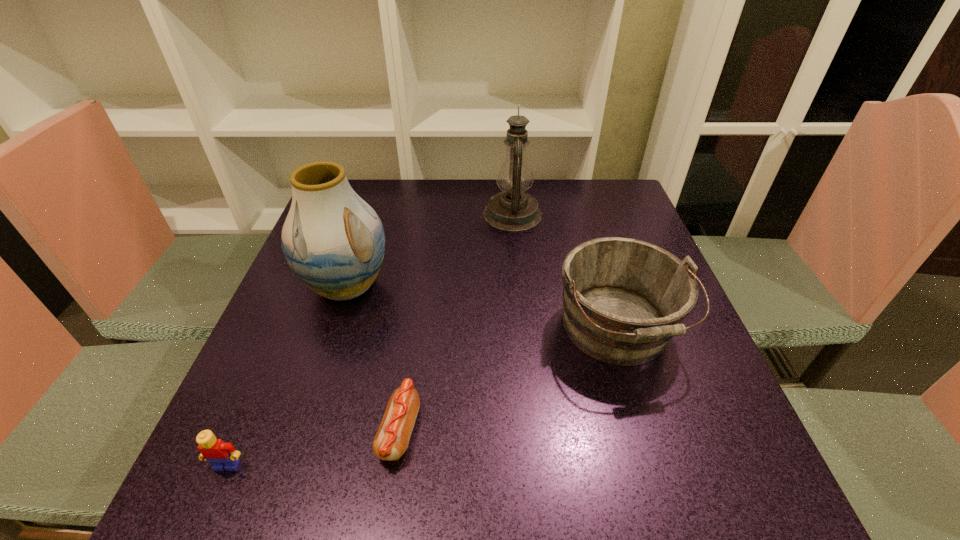
This screenshot has height=540, width=960. In order to click on oil lamp in this screenshot , I will do `click(513, 210)`.

Where is `vase`? This screenshot has width=960, height=540. vase is located at coordinates (334, 242).

Image resolution: width=960 pixels, height=540 pixels. I want to click on the third tallest object, so click(624, 299).

Identify the location of Lego. The image size is (960, 540). (221, 455).

Image resolution: width=960 pixels, height=540 pixels. Identify the location of the shortest object. (391, 441).

In order to click on sausage in this screenshot , I will do `click(391, 441)`.

Where is `vacant area situated 0.320m on the left of the oil lamp`? vacant area situated 0.320m on the left of the oil lamp is located at coordinates (366, 214).

Locate an element on the screen. The height and width of the screenshot is (540, 960). vacant area located on the front of the vase is located at coordinates (315, 384).

Where is `blank space located on the front of the wine bucket`? blank space located on the front of the wine bucket is located at coordinates (655, 455).

Locate an element on the screen. This screenshot has height=540, width=960. free location located on the face of the second shortest object is located at coordinates (209, 507).